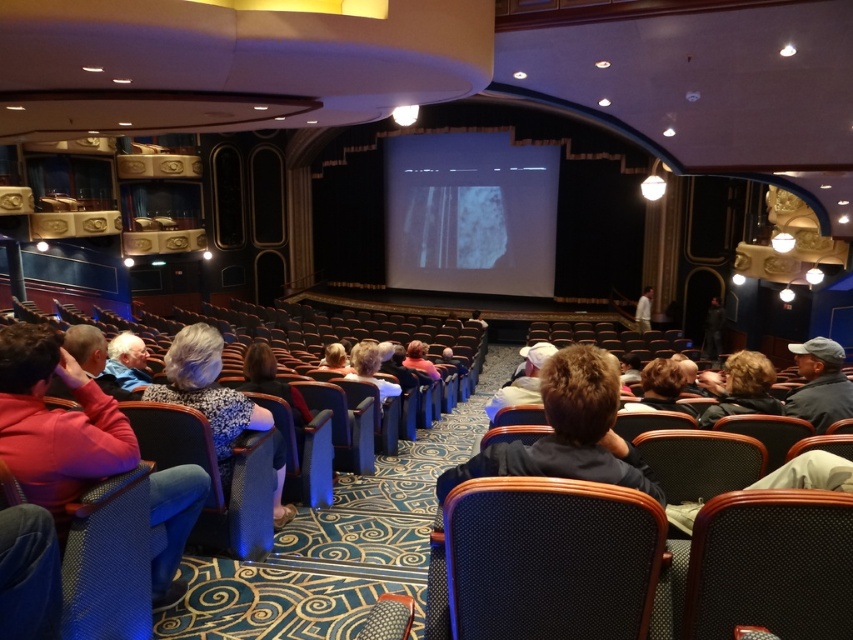
Who is taller, textured black fabric chair at center or gray fabric jacket at left?

gray fabric jacket at left is taller.

From the picture: Who is more distant from viewer, (482,540) or (38,444)?

The point (38,444) is behind.

I want to click on textured black fabric chair at center, so click(x=543, y=561).

Who is positioned more to the left, gray fabric jacket at left or floral-patterned sweater at center?

gray fabric jacket at left is more to the left.

Does gray fabric jacket at left have a lesser height compared to floral-patterned sweater at center?

No, gray fabric jacket at left is not shorter than floral-patterned sweater at center.

Is point (59, 369) farther from camera compared to point (166, 396)?

That is False.

Image resolution: width=853 pixels, height=640 pixels. I want to click on gray fabric jacket at left, so click(x=56, y=420).

Between gray fabric jacket at left and brown fabric jacket at center, which one appears on the right side from the viewer's perspective?

Positioned to the right is brown fabric jacket at center.

Which is below, gray fabric jacket at left or brown fabric jacket at center?

gray fabric jacket at left

Is point (181, 532) positioned in front of point (450, 468)?

No, (181, 532) is further to viewer.

At what (x,y) coordinates should I click in order to perform the action: click on gray fabric jacket at left. Please return your answer as a coordinate pair (x, y). Looking at the image, I should click on (56, 420).